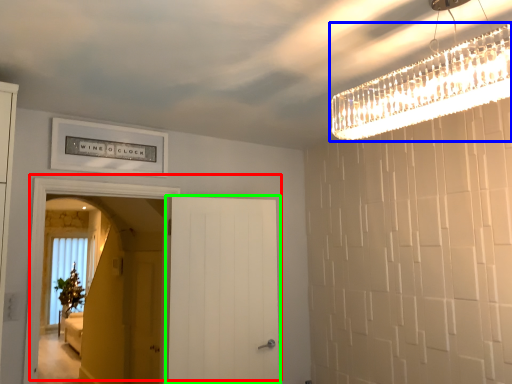
Question: Which object is positioned farthest from door (highlighted by a red box)? Select from light fixture (highlighted by a blue box) and door (highlighted by a green box).

Choices:
 (A) light fixture
 (B) door

Answer: (A)